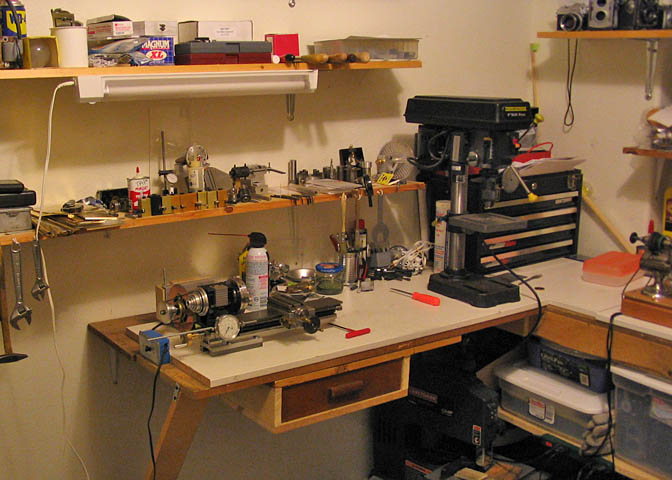
Locate an element on the screen. The width and height of the screenshot is (672, 480). black cords is located at coordinates (536, 304), (149, 420), (612, 344).